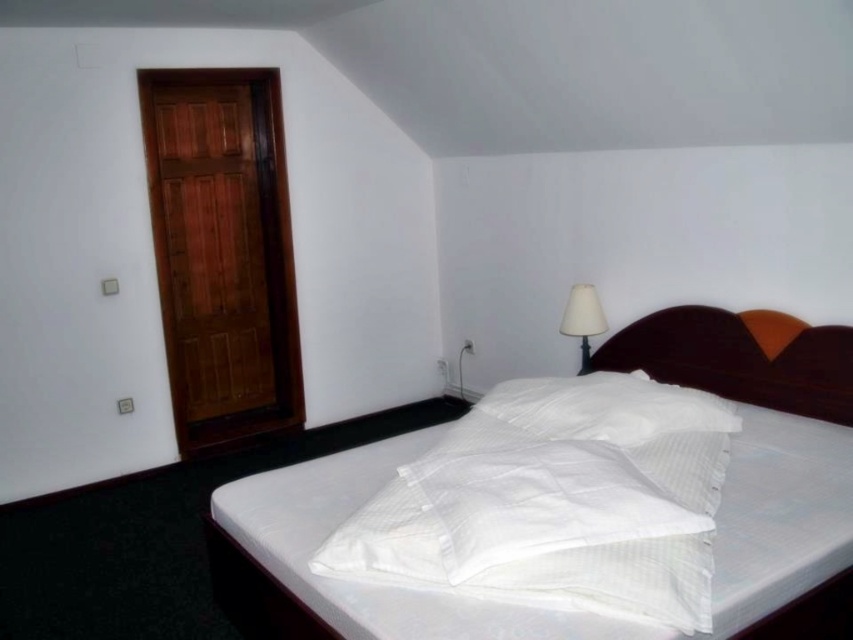
Question: Does white striped bed at center appear on the right side of white fabric lampshade at upper right?

Choices:
 (A) yes
 (B) no

Answer: (A)

Question: Estimate the real-world distances between objects in this image. Which object is farther from the brown fabric headboard at upper right?

Choices:
 (A) white fabric lampshade at upper right
 (B) white textured pillow at center
 (C) white striped bed at center

Answer: (B)

Question: Which object is positioned closest to the white textured pillow at center?

Choices:
 (A) white striped bed at center
 (B) white fabric lampshade at upper right

Answer: (A)

Question: Can you confirm if white textured pillow at center is positioned to the right of white fabric lampshade at upper right?

Choices:
 (A) no
 (B) yes

Answer: (A)

Question: Can you confirm if brown fabric headboard at upper right is positioned below white fabric lampshade at upper right?

Choices:
 (A) yes
 (B) no

Answer: (A)

Question: Among these objects, which one is farthest from the camera?

Choices:
 (A) white striped bed at center
 (B) white fabric lampshade at upper right
 (C) brown fabric headboard at upper right
 (D) white textured pillow at center

Answer: (B)